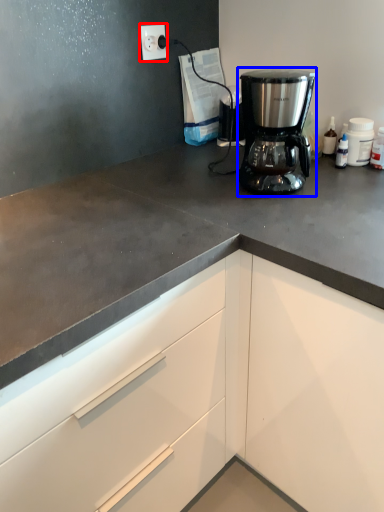
Question: Which object appears farthest to the camera in this image, electric outlet (highlighted by a red box) or coffee maker (highlighted by a blue box)?

Choices:
 (A) electric outlet
 (B) coffee maker

Answer: (A)